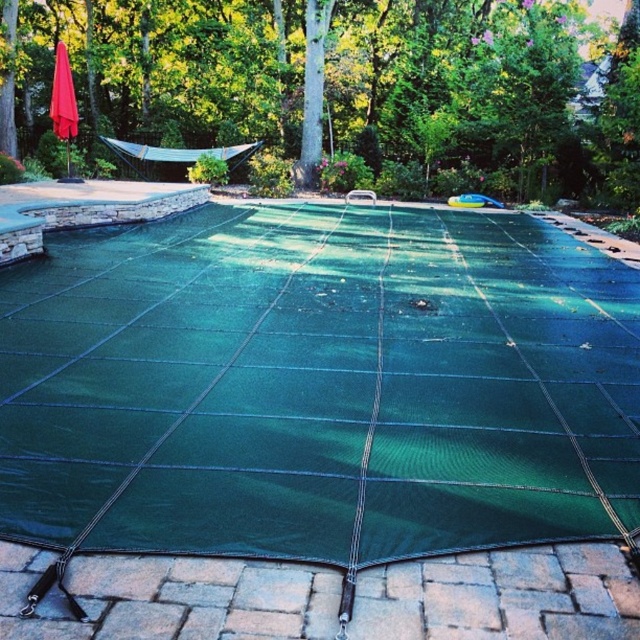
Which is above, green mesh net at center or green mesh netting at center?

Positioned higher is green mesh netting at center.

Is green mesh net at center to the right of green mesh netting at center from the viewer's perspective?

Correct, you'll find green mesh net at center to the right of green mesh netting at center.

Is point (76, 566) positioned before point (493, 138)?

Yes, point (76, 566) is in front of point (493, 138).

Identify the location of green mesh net at center. (317, 426).

Between green mesh netting at center and red fabric umbrella at upper left, which one has less height?

red fabric umbrella at upper left is shorter.

Does green mesh netting at center have a lesser width compared to red fabric umbrella at upper left?

In fact, green mesh netting at center might be wider than red fabric umbrella at upper left.

What are the coordinates of `green mesh netting at center` in the screenshot? It's located at (342, 88).

Does green mesh net at center have a lesser height compared to red fabric umbrella at upper left?

No, green mesh net at center is not shorter than red fabric umbrella at upper left.

Looking at this image, which is more to the left, green mesh net at center or red fabric umbrella at upper left?

From the viewer's perspective, red fabric umbrella at upper left appears more on the left side.

What do you see at coordinates (317, 426) in the screenshot? This screenshot has height=640, width=640. I see `green mesh net at center` at bounding box center [317, 426].

I want to click on green mesh net at center, so click(x=317, y=426).